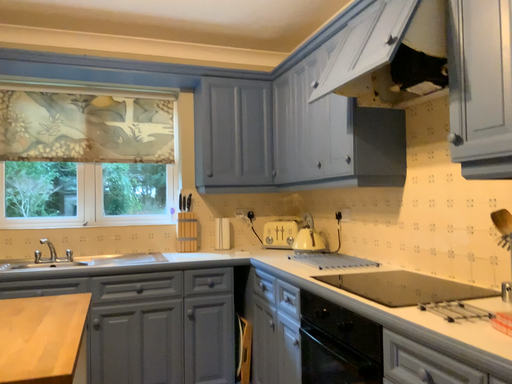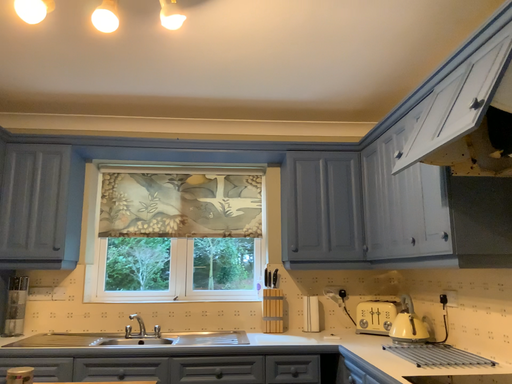
Question: Which way did the camera rotate in the video?

Choices:
 (A) rotated downward
 (B) rotated upward

Answer: (B)